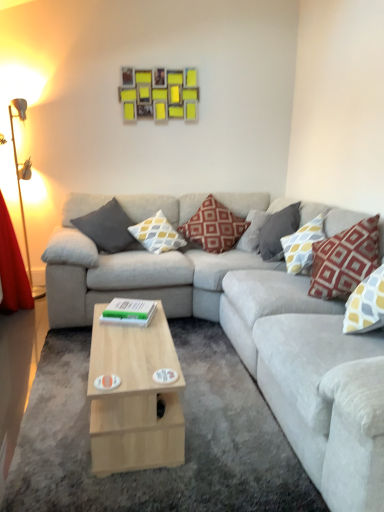
Question: Does red fabric pillow at center, which ranks as the fourth pillow in right-to-left order, turn towards yellow and gray patterned pillow at center, which ranks as the 2th pillow in left-to-right order?

Choices:
 (A) yes
 (B) no

Answer: (B)

Question: Does red fabric pillow at center, which ranks as the fourth pillow in right-to-left order, appear on the right side of yellow and gray patterned pillow at center, positioned as the 5th pillow in right-to-left order?

Choices:
 (A) yes
 (B) no

Answer: (A)

Question: Considering the relative sizes of red fabric pillow at center, the third pillow when ordered from left to right, and yellow and gray patterned pillow at center, which ranks as the 2th pillow in left-to-right order, in the image provided, is red fabric pillow at center, the third pillow when ordered from left to right, wider than yellow and gray patterned pillow at center, which ranks as the 2th pillow in left-to-right order,?

Choices:
 (A) yes
 (B) no

Answer: (A)

Question: From the image's perspective, would you say red fabric pillow at center, which ranks as the fourth pillow in right-to-left order, is positioned over yellow and gray patterned pillow at center, positioned as the 5th pillow in right-to-left order?

Choices:
 (A) no
 (B) yes

Answer: (B)

Question: From the image's perspective, is red fabric pillow at center, the third pillow when ordered from left to right, under yellow and gray patterned pillow at center, which ranks as the 2th pillow in left-to-right order?

Choices:
 (A) yes
 (B) no

Answer: (B)

Question: From a real-world perspective, is red fabric pillow at center, which ranks as the fourth pillow in right-to-left order, physically above yellow and gray patterned pillow at center, which ranks as the 2th pillow in left-to-right order?

Choices:
 (A) no
 (B) yes

Answer: (A)

Question: Can you confirm if green matte book at center is shorter than light gray fabric couch at center?

Choices:
 (A) no
 (B) yes

Answer: (B)

Question: Can you confirm if green matte book at center is positioned to the left of light gray fabric couch at center?

Choices:
 (A) no
 (B) yes

Answer: (B)

Question: Is green matte book at center turned away from light gray fabric couch at center?

Choices:
 (A) yes
 (B) no

Answer: (A)

Question: Can light gray fabric couch at center be found inside green matte book at center?

Choices:
 (A) no
 (B) yes

Answer: (A)

Question: Is green matte book at center not near light gray fabric couch at center?

Choices:
 (A) yes
 (B) no

Answer: (B)

Question: Is green matte book at center smaller than light gray fabric couch at center?

Choices:
 (A) no
 (B) yes

Answer: (B)

Question: Does green matte book at center contain gray fabric pillow at upper right, the fourth pillow viewed from the left?

Choices:
 (A) no
 (B) yes

Answer: (A)